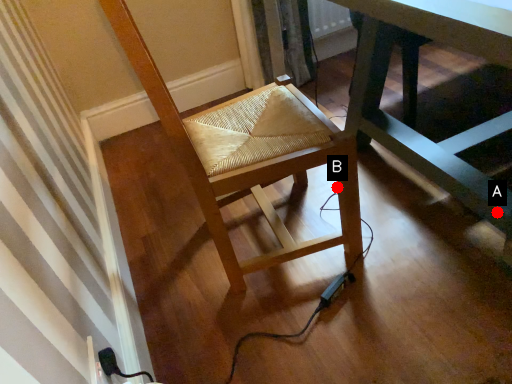
Question: Two points are circled on the image, labeled by A and B beside each circle. Which point is closer to the camera taking this photo?

Choices:
 (A) A is closer
 (B) B is closer

Answer: (A)